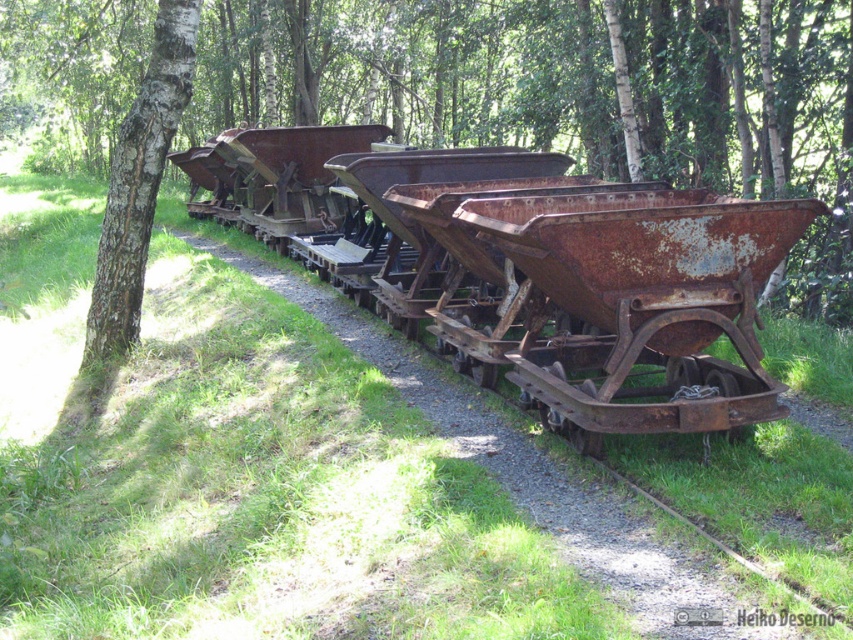
Question: Is rusty metal wagon at center bigger than white bark tree at left?

Choices:
 (A) no
 (B) yes

Answer: (B)

Question: Which point is farther from the camera taking this photo?

Choices:
 (A) (142, 152)
 (B) (519, 321)

Answer: (A)

Question: Which point is farther to the camera?

Choices:
 (A) (740, 428)
 (B) (137, 256)

Answer: (B)

Question: Does rusty metal wagon at center have a larger size compared to white bark tree at left?

Choices:
 (A) no
 (B) yes

Answer: (B)

Question: Is rusty metal wagon at center to the right of white bark tree at left from the viewer's perspective?

Choices:
 (A) no
 (B) yes

Answer: (B)